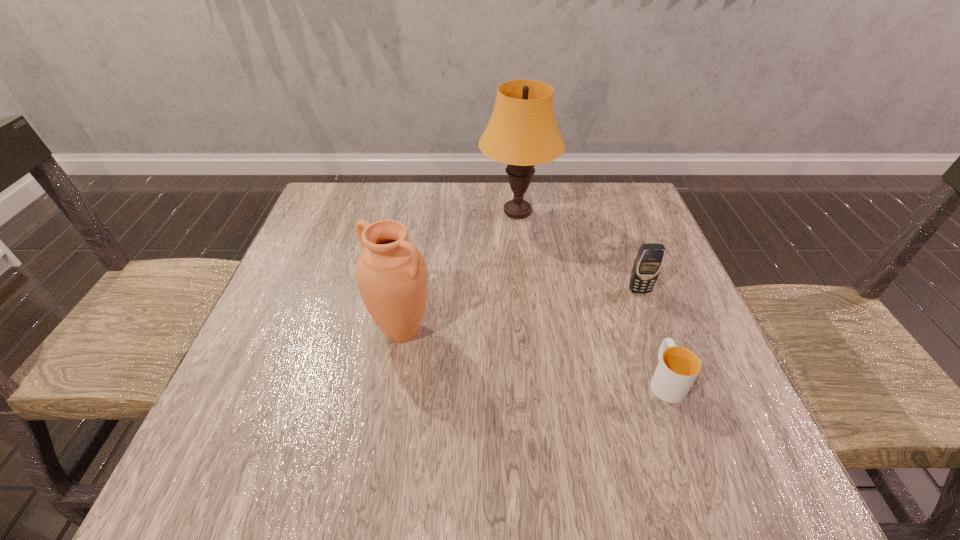
Where is `vacant point at the right edge`? The height and width of the screenshot is (540, 960). vacant point at the right edge is located at coordinates (716, 366).

Locate an element on the screen. vacant space at the far left corner of the desktop is located at coordinates (325, 197).

In the image, there is a desktop. At what (x,y) coordinates should I click in order to perform the action: click on vacant space at the near left corner. Please return your answer as a coordinate pair (x, y). Looking at the image, I should click on (238, 479).

Where is `free location at the far right corner`? free location at the far right corner is located at coordinates (591, 197).

The image size is (960, 540). I want to click on free space at the near right corner of the desktop, so click(748, 463).

What are the coordinates of `free space between the cellular telephone and the farthest object` in the screenshot? It's located at (578, 251).

Where is `free space between the shortest object and the second farthest object`? The width and height of the screenshot is (960, 540). free space between the shortest object and the second farthest object is located at coordinates (652, 335).

What are the coordinates of `blank region between the shortest object and the second shortest object` in the screenshot? It's located at (652, 335).

Where is `unoccupied area between the leftmost object and the second shortest object`? unoccupied area between the leftmost object and the second shortest object is located at coordinates (520, 311).

Identify the location of vacant area between the third object from right to left and the cup. The image size is (960, 540). (591, 296).